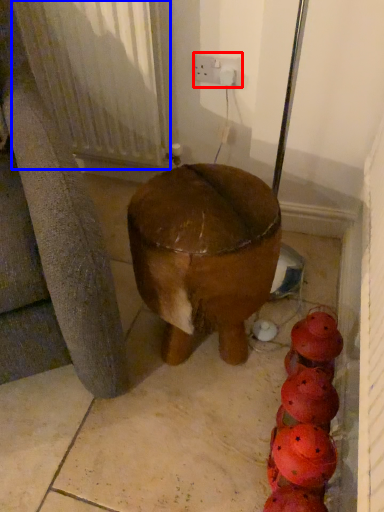
Question: Which of the following is the farthest to the observer, electric outlet (highlighted by a red box) or radiator (highlighted by a blue box)?

Choices:
 (A) electric outlet
 (B) radiator

Answer: (A)